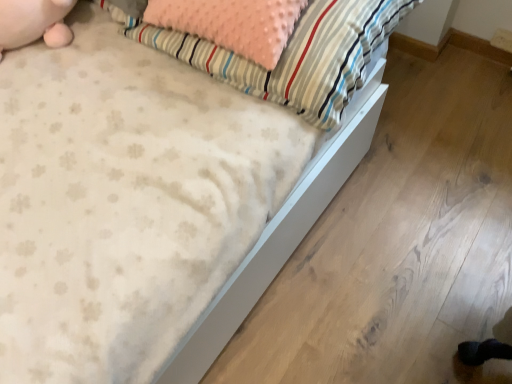
Question: Is point (218, 76) positioned closer to the camera than point (7, 34)?

Choices:
 (A) farther
 (B) closer

Answer: (B)

Question: Considering the positions of fluffy pink pillow at upper center and pink plush toy at upper left in the image, is fluffy pink pillow at upper center bigger or smaller than pink plush toy at upper left?

Choices:
 (A) big
 (B) small

Answer: (A)

Question: Is fluffy pink pillow at upper center spatially inside pink plush toy at upper left, or outside of it?

Choices:
 (A) outside
 (B) inside

Answer: (A)

Question: From a real-world perspective, is pink plush toy at upper left above or below fluffy pink pillow at upper center?

Choices:
 (A) above
 (B) below

Answer: (A)

Question: Is pink plush toy at upper left situated inside fluffy pink pillow at upper center or outside?

Choices:
 (A) outside
 (B) inside

Answer: (A)

Question: Is pink plush toy at upper left to the left or to the right of fluffy pink pillow at upper center in the image?

Choices:
 (A) left
 (B) right

Answer: (A)

Question: From the image's perspective, is pink plush toy at upper left located above or below fluffy pink pillow at upper center?

Choices:
 (A) above
 (B) below

Answer: (A)